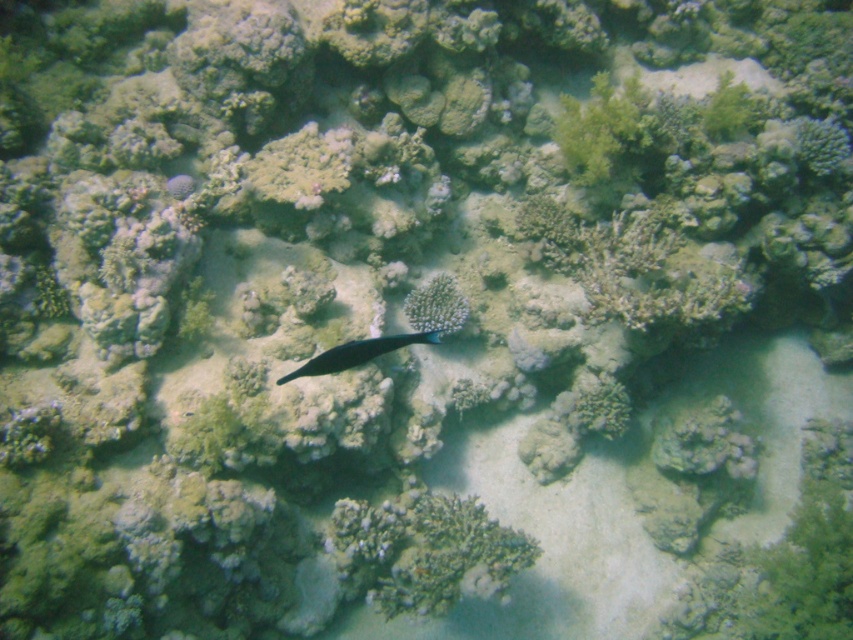
Which is in front, point (445, 321) or point (329, 349)?

Point (329, 349) is more forward.

Between point (430, 321) and point (360, 358), which one is positioned behind?

Point (430, 321)

In order to click on white porous coral at center in this screenshot , I will do `click(436, 305)`.